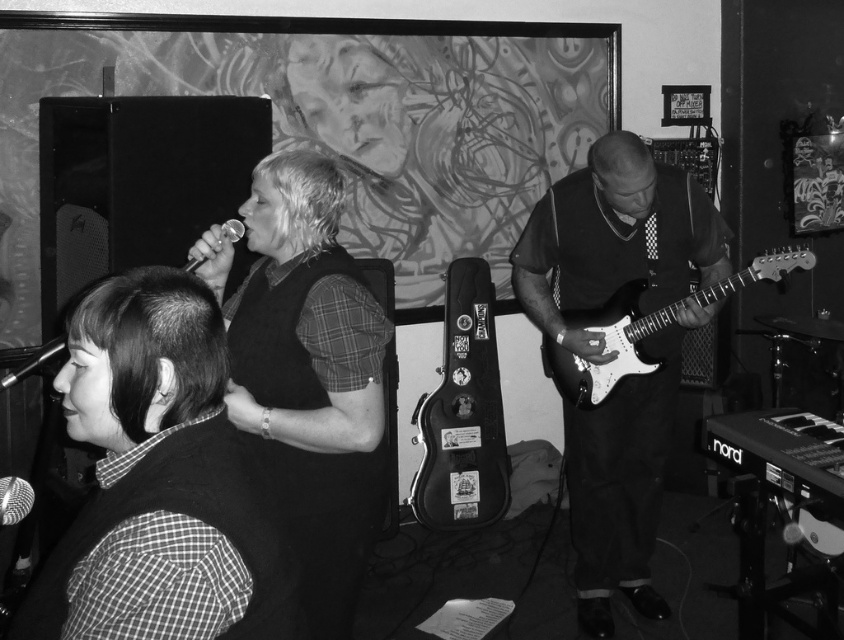
You are a photographer adjusting the lighting for the band members. You notice the matte black vest at upper center and the black leather guitar case at center. Which object is more to the left?

The matte black vest at upper center is positioned on the left side of the black leather guitar case at center, so it is more to the left.

In the image, there are two guitars, a matte black guitar at center and a white glossy electric guitar at right. Which guitar is positioned to the left of the other?

The matte black guitar at center is positioned to the left of the white glossy electric guitar at right.